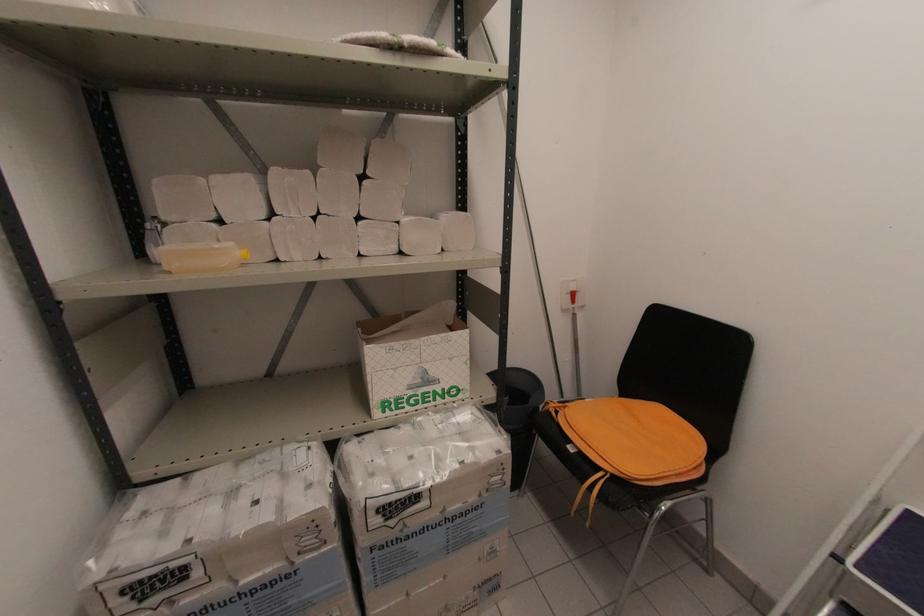
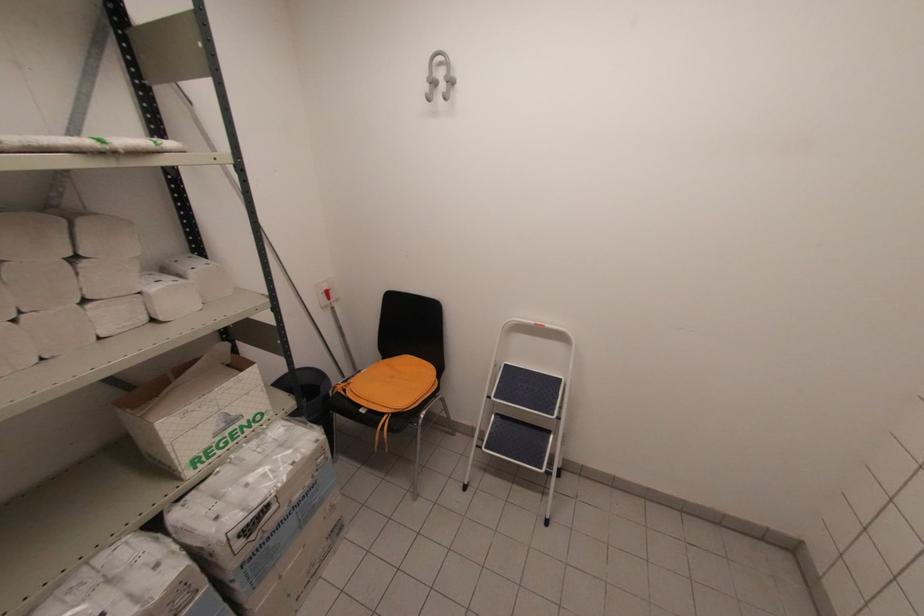
Find the pixel in the second image that matches (369,174) in the first image.

(81, 254)